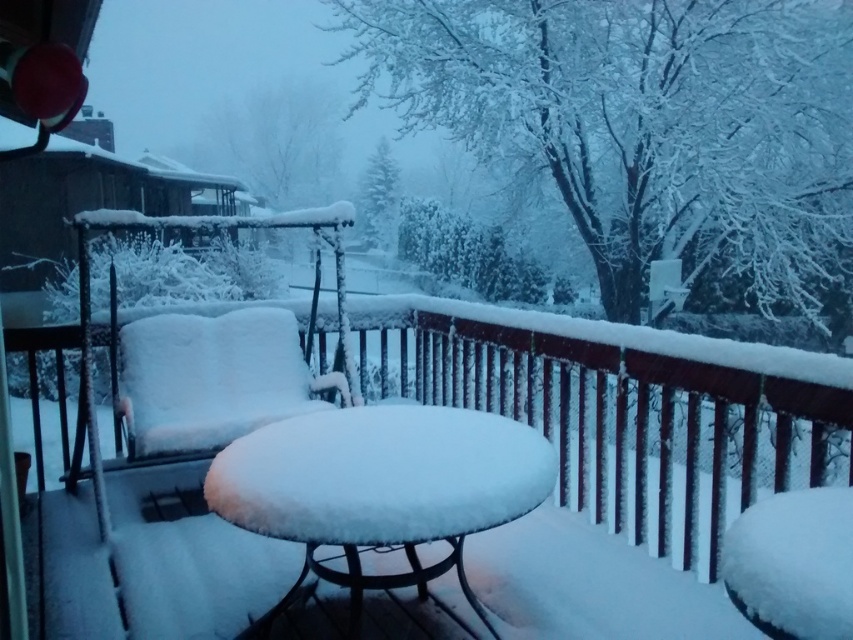
Does white snow-covered table at center have a smaller size compared to white fluffy cushion at center?

Yes, white snow-covered table at center is smaller than white fluffy cushion at center.

Between point (265, 476) and point (154, 451), which one is positioned in front?

Point (265, 476) is in front.

Where is `white snow-covered table at center`? white snow-covered table at center is located at coordinates (380, 486).